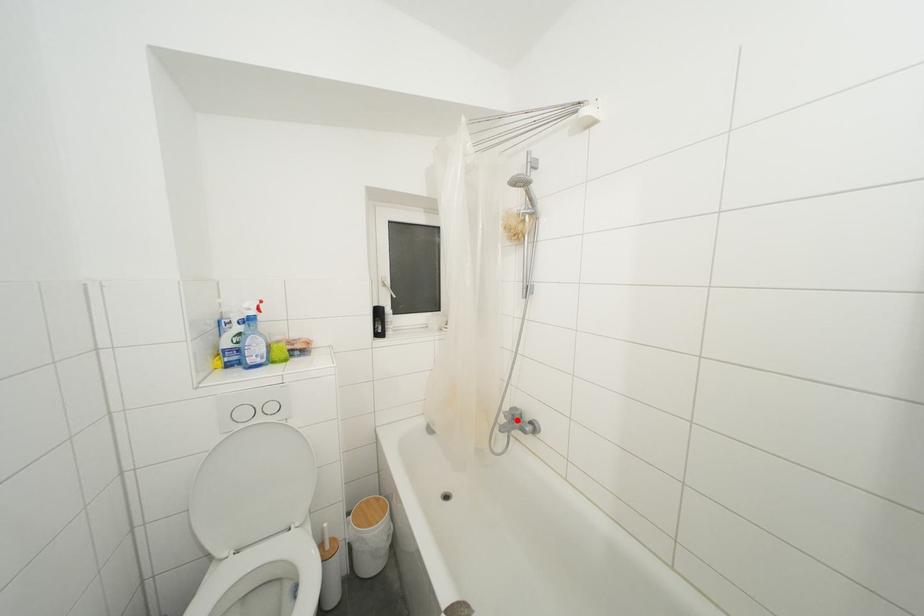
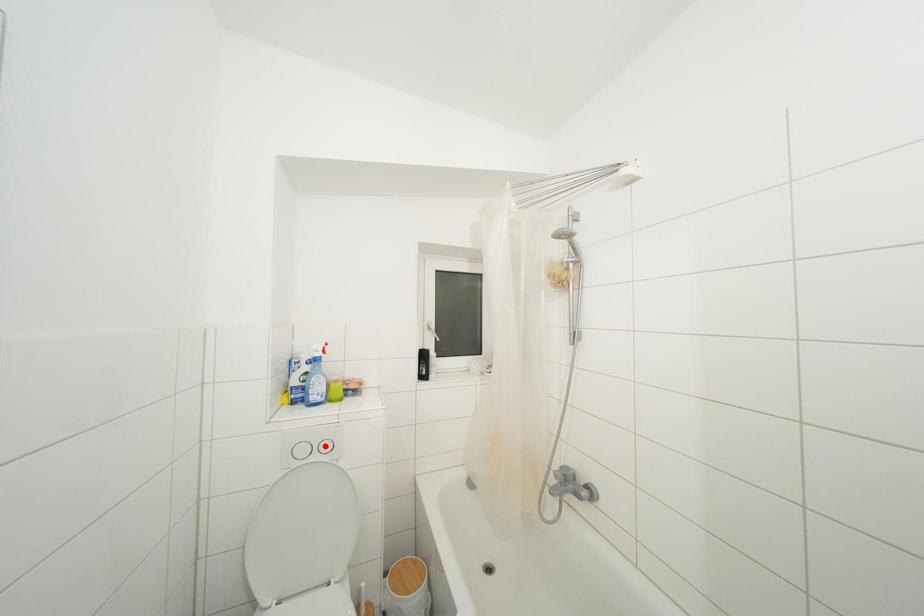
I am providing you with two images of the same scene from different viewpoints. A red point is marked on the first image and another point is marked on the second image. Is the red point in image1 aligned with the point shown in image2?

No